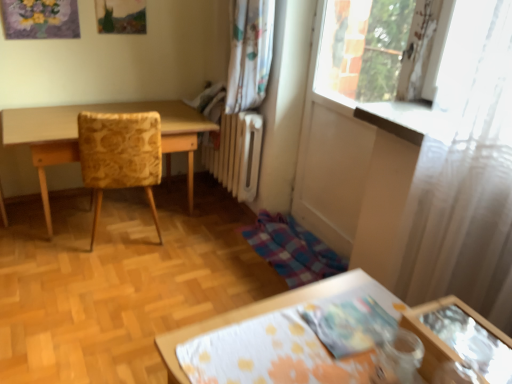
Locate an element on the screen. Image resolution: width=512 pixels, height=384 pixels. vacant space to the right of yellow floral fabric chair at left is located at coordinates (197, 241).